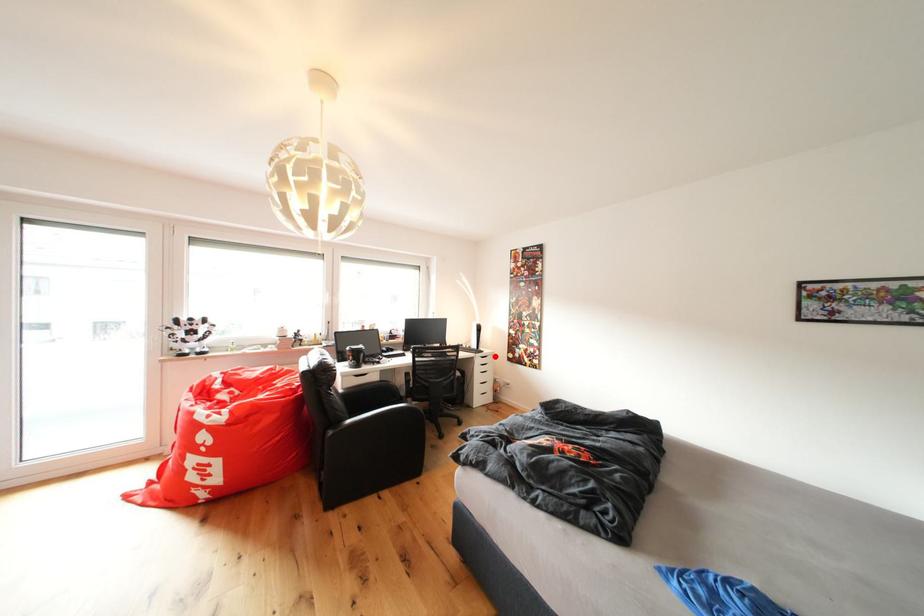
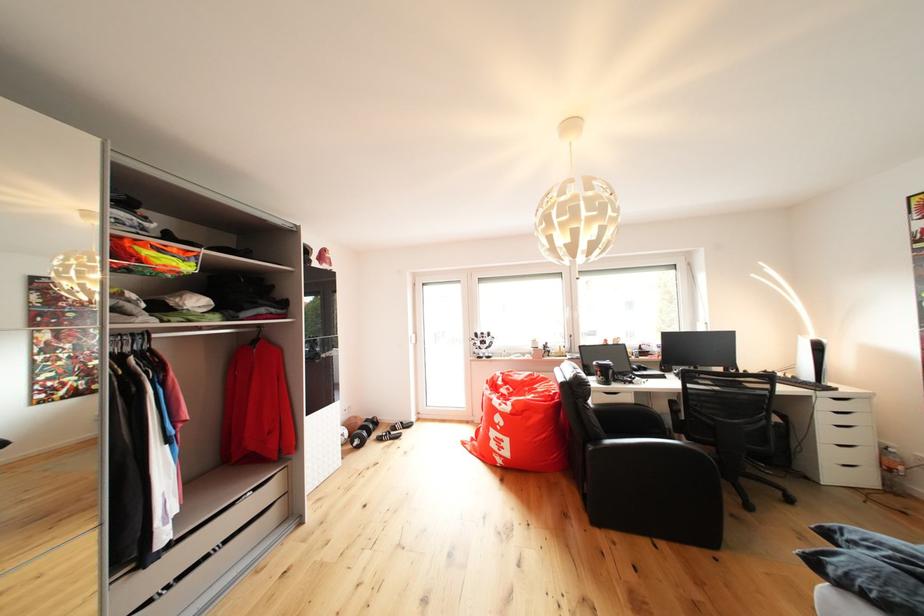
Question: I am providing you with two images of the same scene from different viewpoints. Given a red point in image1, look at the same physical point in image2. Is it:

Choices:
 (A) Closer to the viewpoint
 (B) Farther from the viewpoint

Answer: (A)